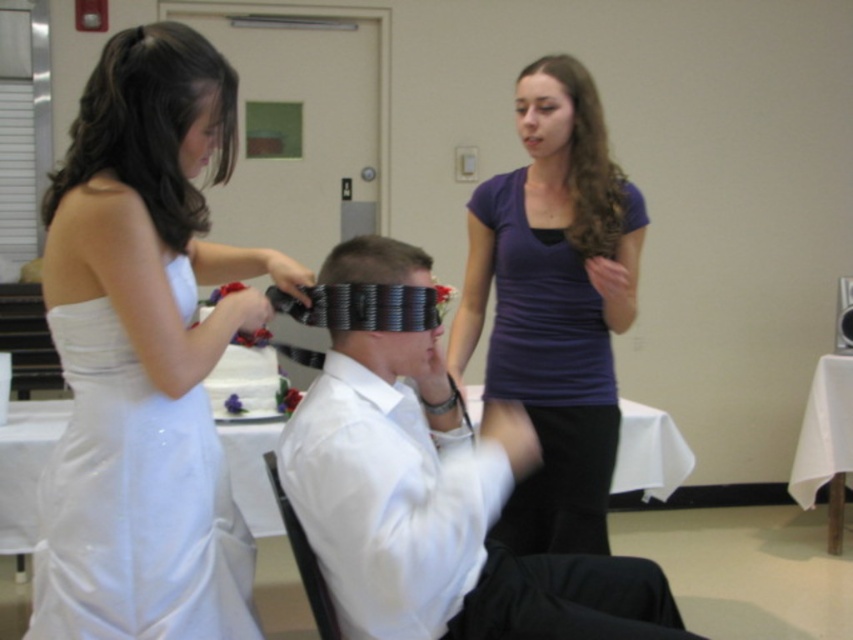
You are organizing a closet for a couple attending a formal event. The white satin dress at left and the white glossy shirt at center need to be stored. Given their sizes, which one should be placed on the higher shelf to prevent the smaller item from being crushed by the larger one?

The white satin dress at left is smaller than the white glossy shirt at center, so the white glossy shirt at center should be placed on the higher shelf to prevent it from crushing the smaller dress below.

You are planning to seat guests at a table for two. The table can only accommodate one person comfortably. Based on the image, which of the two items, the white satin dress at left or the purple matte shirt at upper center, belongs to a person who might need more space?

The purple matte shirt at upper center has a greater width than the white satin dress at left, so the person wearing the purple matte shirt at upper center would require more space and should be seated accordingly.

You are a photographer at a wedding reception and need to capture a photo of both the white satin dress at left and the white glossy shirt at center. Which one should you focus on first to ensure it appears sharp in the photo?

The white satin dress at left is closer to the photographer, so focusing on it first will ensure it appears sharp. The white glossy shirt at center is farther away, so adjusting focus accordingly would be necessary for both to be clear.